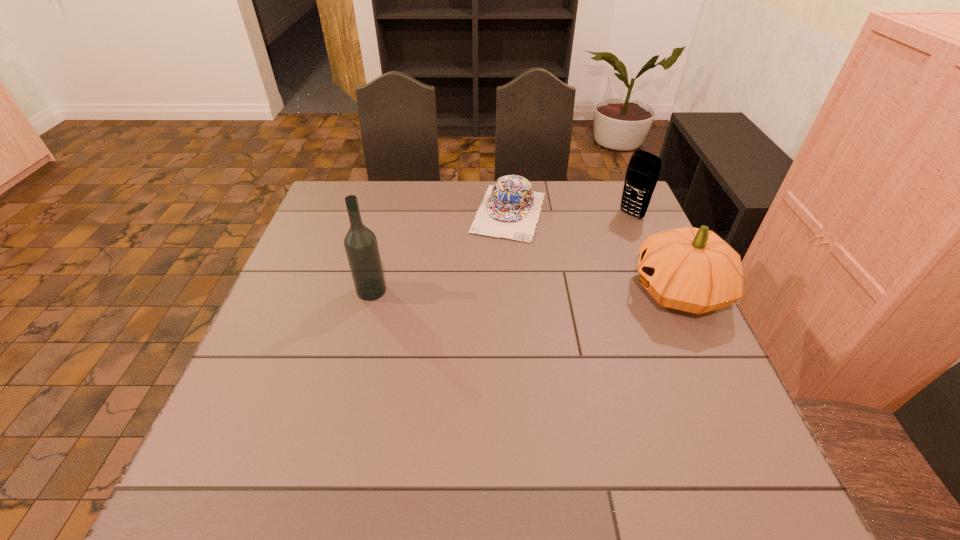
Find the location of `vacant area that lies between the gourd and the shortest object`. vacant area that lies between the gourd and the shortest object is located at coordinates (594, 252).

The width and height of the screenshot is (960, 540). I want to click on free point between the cellular telephone and the cap, so 570,214.

The image size is (960, 540). In order to click on vacant region between the third object from right to left and the vodka in this screenshot , I will do `click(441, 252)`.

You are a GUI agent. You are given a task and a screenshot of the screen. Output one action in this format:
    pyautogui.click(x=<x>, y=<y>)
    Task: Click on the object that is the second closest to the gourd
    The width and height of the screenshot is (960, 540).
    Given the screenshot: What is the action you would take?
    pyautogui.click(x=511, y=208)

The image size is (960, 540). I want to click on object that is the third nearest to the cellular telephone, so click(360, 243).

The image size is (960, 540). I want to click on free spot that satisfies the following two spatial constraints: 1. on the front side of the cap; 2. on the side of the gourd with the carved face, so click(516, 292).